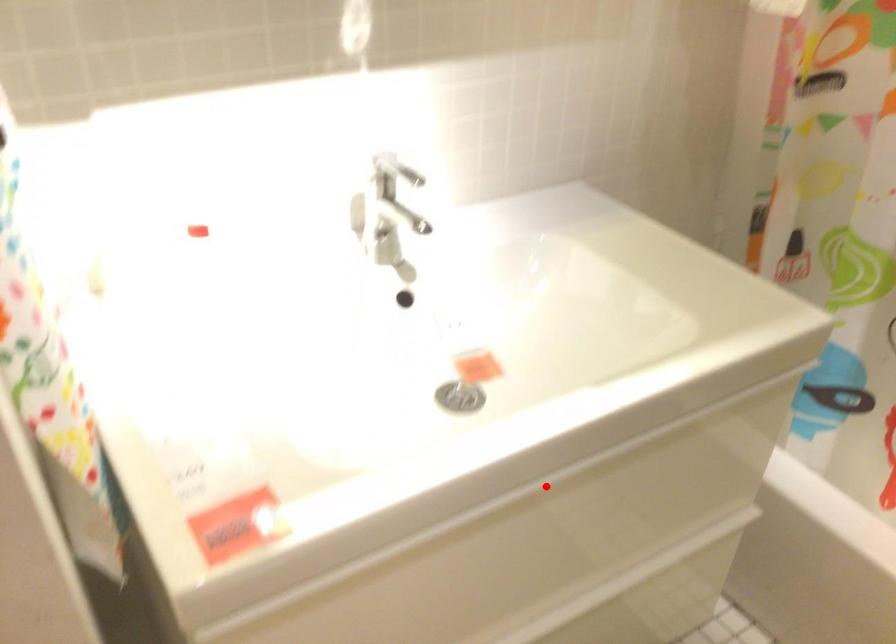
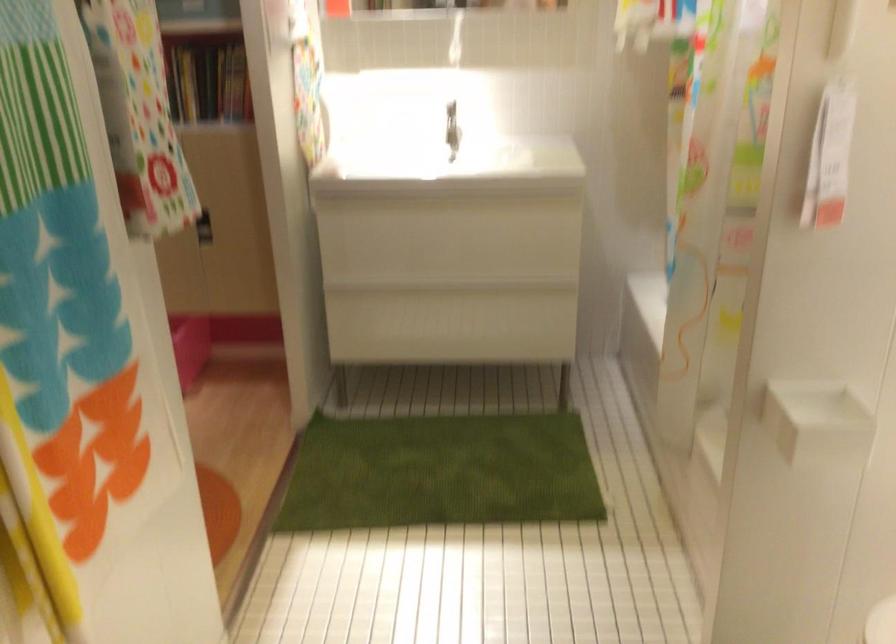
The point at the highlighted location is marked in the first image. Where is the corresponding point in the second image?

(440, 201)